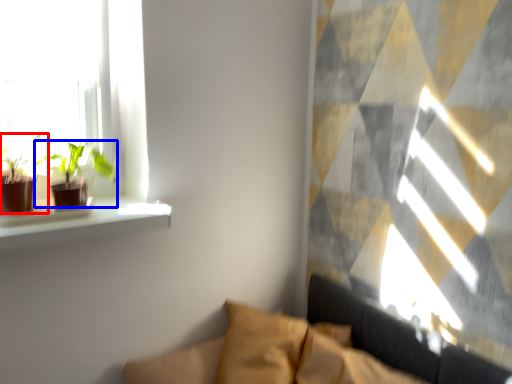
Question: Which object appears farthest to the camera in this image, houseplant (highlighted by a red box) or houseplant (highlighted by a blue box)?

Choices:
 (A) houseplant
 (B) houseplant

Answer: (B)